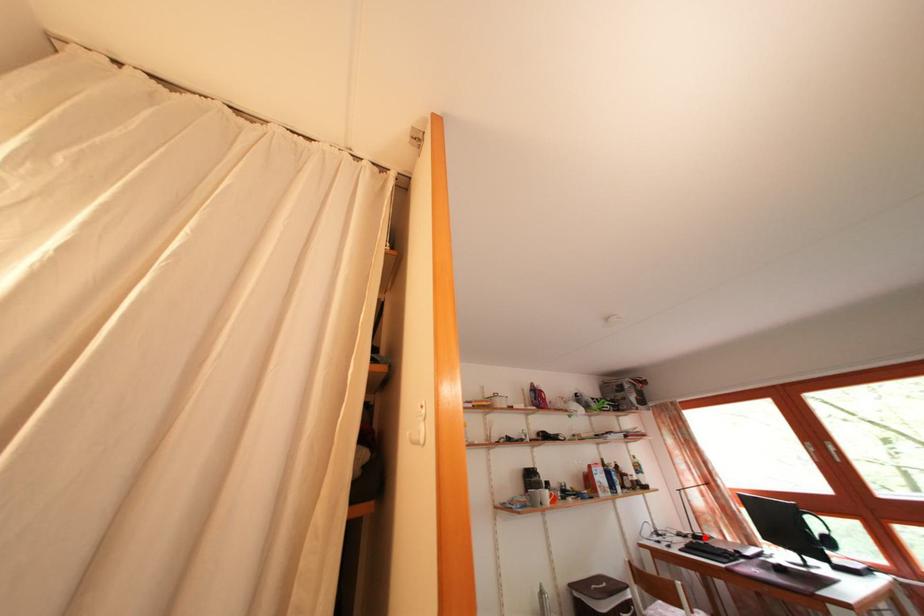
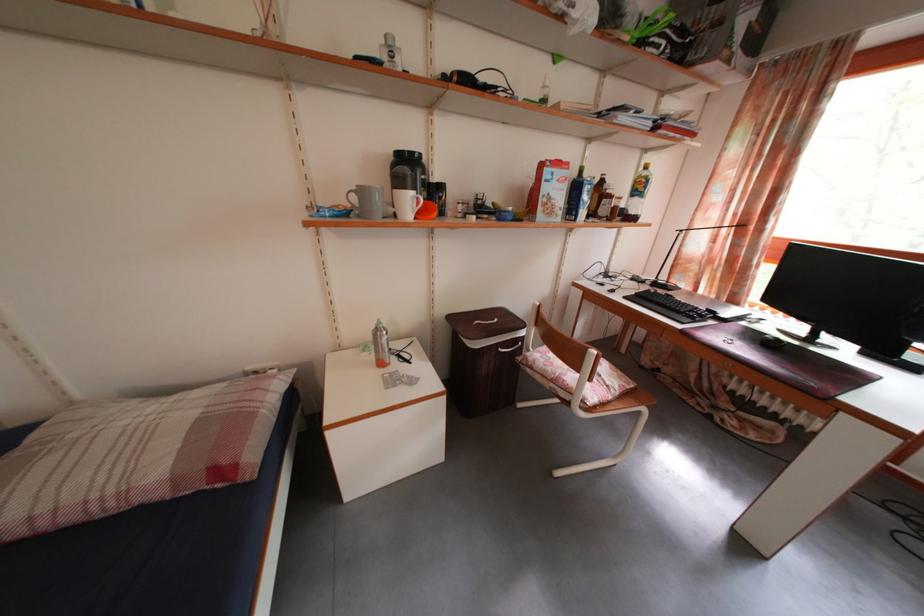
Locate, in the second image, the point that corresponds to the highlighted location in the first image.

(671, 285)